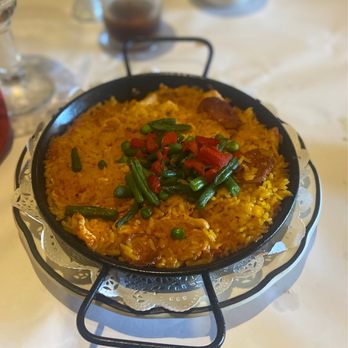
Where is `handles`? The height and width of the screenshot is (348, 348). handles is located at coordinates (221, 316), (85, 330), (124, 53), (197, 40).